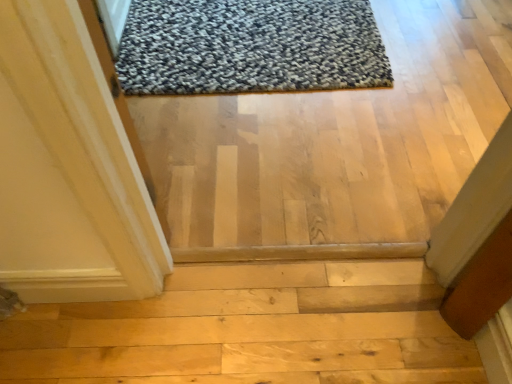
Question: Is the depth of natural wood stairs at center less than that of textured gray rug at upper center?

Choices:
 (A) yes
 (B) no

Answer: (A)

Question: From the image's perspective, is natural wood stairs at center above textured gray rug at upper center?

Choices:
 (A) no
 (B) yes

Answer: (A)

Question: Can you confirm if natural wood stairs at center is thinner than textured gray rug at upper center?

Choices:
 (A) no
 (B) yes

Answer: (B)

Question: Is natural wood stairs at center touching textured gray rug at upper center?

Choices:
 (A) yes
 (B) no

Answer: (B)

Question: Does natural wood stairs at center turn towards textured gray rug at upper center?

Choices:
 (A) yes
 (B) no

Answer: (A)

Question: Is natural wood stairs at center taller than textured gray rug at upper center?

Choices:
 (A) yes
 (B) no

Answer: (A)

Question: Is textured gray rug at upper center positioned with its back to natural wood stairs at center?

Choices:
 (A) yes
 (B) no

Answer: (B)

Question: Can you confirm if textured gray rug at upper center is taller than natural wood stairs at center?

Choices:
 (A) no
 (B) yes

Answer: (A)

Question: From the image's perspective, is textured gray rug at upper center under natural wood stairs at center?

Choices:
 (A) no
 (B) yes

Answer: (A)

Question: Is textured gray rug at upper center to the left of natural wood stairs at center from the viewer's perspective?

Choices:
 (A) no
 (B) yes

Answer: (A)

Question: From a real-world perspective, is textured gray rug at upper center under natural wood stairs at center?

Choices:
 (A) yes
 (B) no

Answer: (B)

Question: Is textured gray rug at upper center positioned before natural wood stairs at center?

Choices:
 (A) yes
 (B) no

Answer: (B)

Question: Looking at the image, does natural wood stairs at center seem bigger or smaller compared to textured gray rug at upper center?

Choices:
 (A) big
 (B) small

Answer: (A)